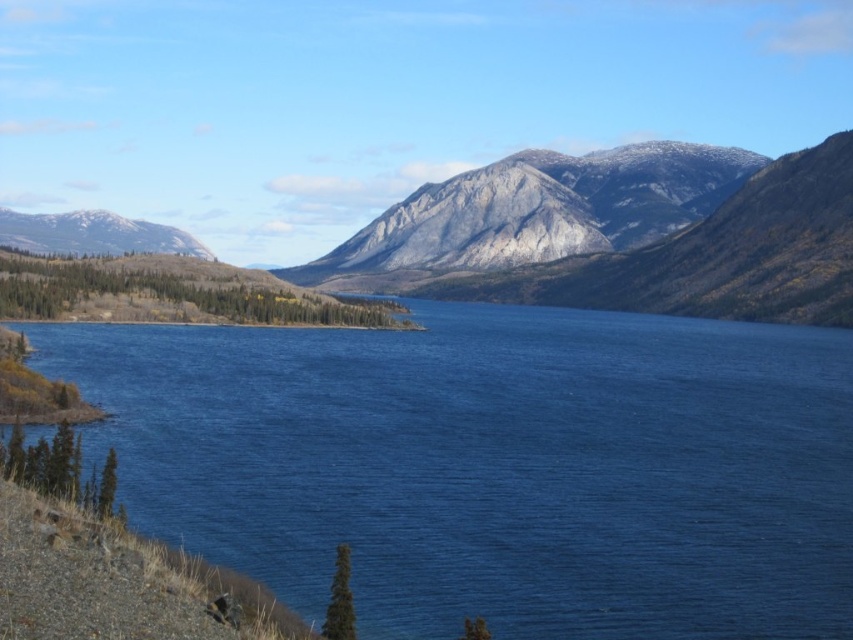
Does point (480, 474) lie behind point (126, 244)?

No, it is not.

Is blue liquid water at center to the left of gray rocky mountain at left from the viewer's perspective?

Incorrect, blue liquid water at center is not on the left side of gray rocky mountain at left.

The height and width of the screenshot is (640, 853). Find the location of `blue liquid water at center`. blue liquid water at center is located at coordinates (494, 467).